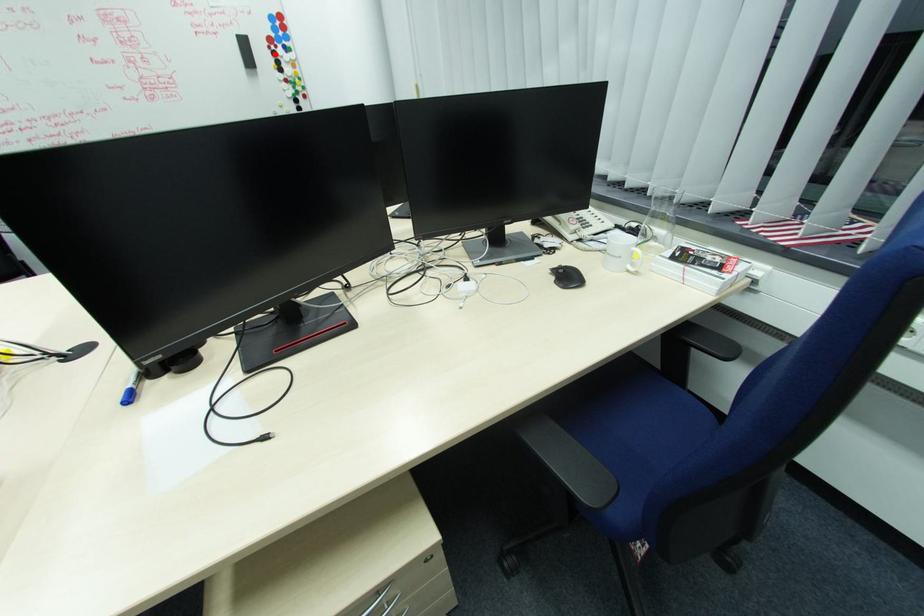
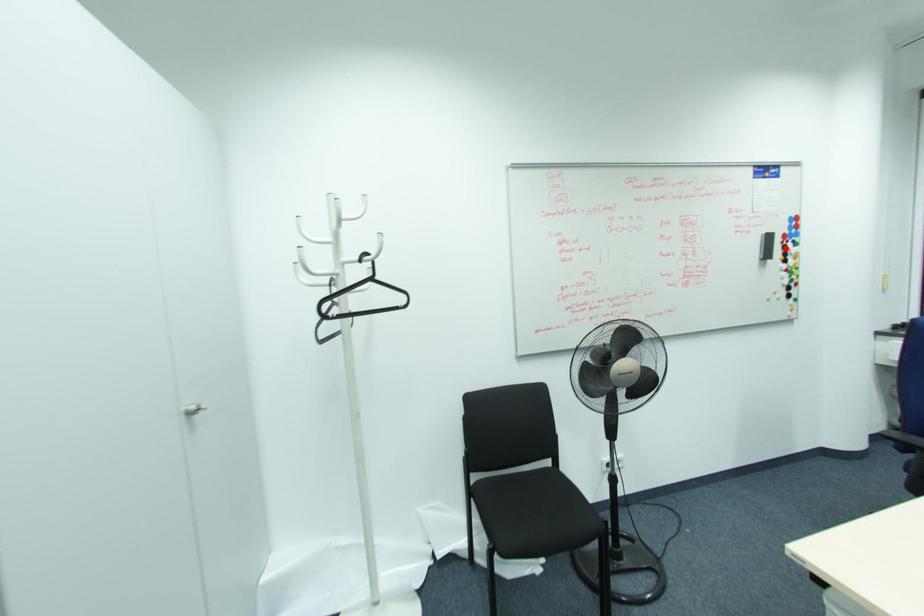
I am providing you with two images of the same scene from different viewpoints. A red point is marked on the first image and another point is marked on the second image. Is the marked point in image1 the same physical position as the marked point in image2?

Yes